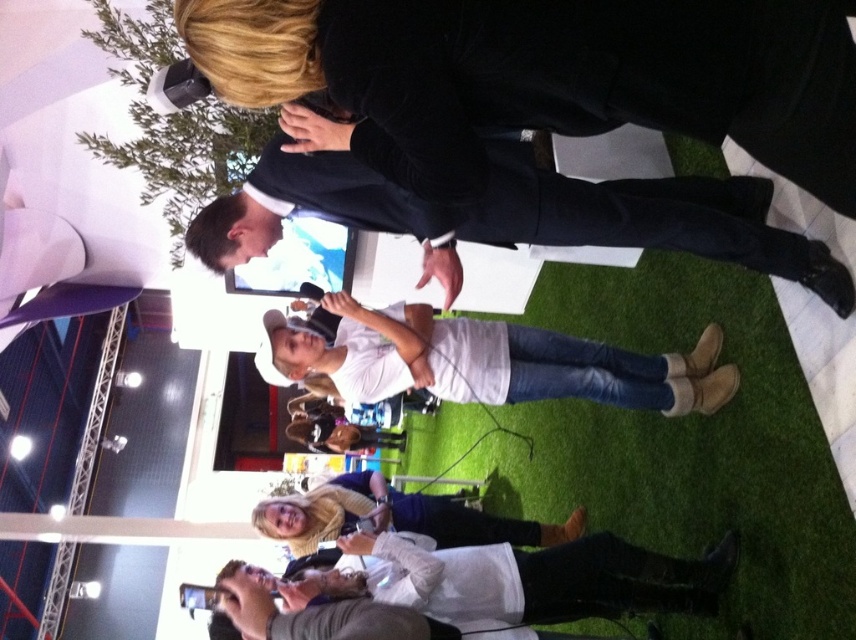
Between black velvet suit at upper center and matte white phone at center, which one appears on the left side from the viewer's perspective?

Positioned to the left is matte white phone at center.

Is black velvet suit at upper center shorter than matte white phone at center?

Yes, black velvet suit at upper center is shorter than matte white phone at center.

Which is behind, point (815, 188) or point (461, 509)?

The point (461, 509) is more distant.

You are a GUI agent. You are given a task and a screenshot of the screen. Output one action in this format:
    pyautogui.click(x=<x>, y=<y>)
    Task: Click on the black velvet suit at upper center
    This screenshot has height=640, width=856.
    Given the screenshot: What is the action you would take?
    point(593,81)

Can you confirm if black suit at upper center is thinner than white matte shirt at center?

Yes.

Can you confirm if black suit at upper center is positioned to the left of white matte shirt at center?

In fact, black suit at upper center is to the right of white matte shirt at center.

Is point (360, 211) closer to viewer compared to point (705, 339)?

Yes.

The width and height of the screenshot is (856, 640). Find the location of `black suit at upper center`. black suit at upper center is located at coordinates (515, 216).

The width and height of the screenshot is (856, 640). Describe the element at coordinates (488, 362) in the screenshot. I see `white matte shirt at center` at that location.

What are the coordinates of `white matte shirt at center` in the screenshot? It's located at (488, 362).